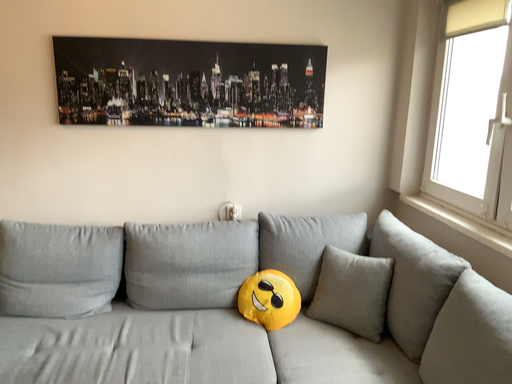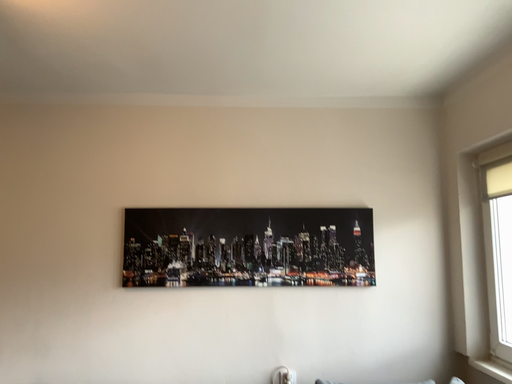
Question: How did the camera likely rotate when shooting the video?

Choices:
 (A) rotated downward
 (B) rotated upward

Answer: (B)